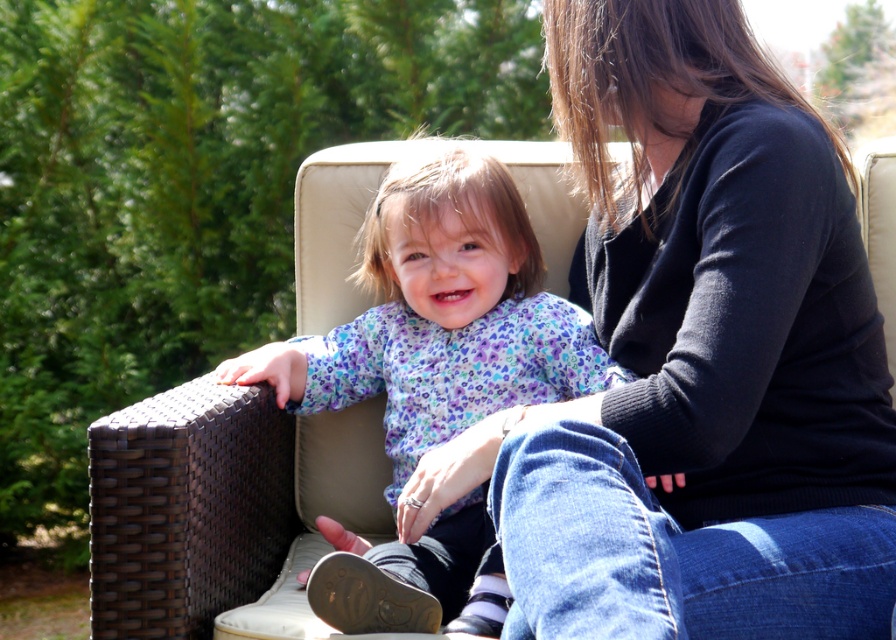
Does black sweater at upper right have a lesser height compared to purple floral shirt at center?

No.

Does point (764, 518) come behind point (500, 305)?

No, it is not.

I want to click on black sweater at upper right, so click(x=705, y=355).